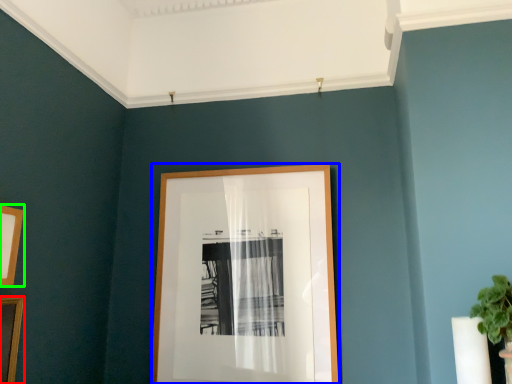
Question: Estimate the real-world distances between objects in this image. Which object is closer to picture frame (highlighted by a red box), picture frame (highlighted by a blue box) or picture frame (highlighted by a green box)?

Choices:
 (A) picture frame
 (B) picture frame

Answer: (B)